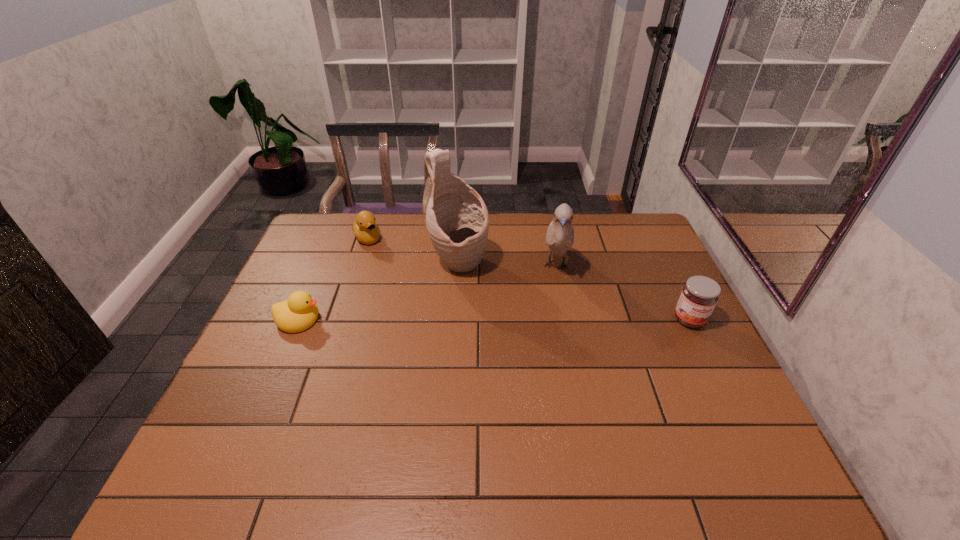
Image resolution: width=960 pixels, height=540 pixels. In order to click on vacant region between the shorter duckling and the pitcher in this screenshot , I will do `click(379, 292)`.

The width and height of the screenshot is (960, 540). I want to click on unoccupied position between the rightmost object and the second tallest object, so click(x=622, y=293).

Identify the location of free point between the fourth object from right to left and the third object from right to left. (413, 252).

The width and height of the screenshot is (960, 540). What are the coordinates of `empty space that is in between the jam and the shorter duckling` in the screenshot? It's located at (494, 319).

You are a GUI agent. You are given a task and a screenshot of the screen. Output one action in this format:
    pyautogui.click(x=<x>, y=<y>)
    Task: Click on the unoccupied area between the nearer duckling and the rightmost object
    This screenshot has width=960, height=540.
    Given the screenshot: What is the action you would take?
    pyautogui.click(x=494, y=319)

This screenshot has height=540, width=960. I want to click on vacant area between the tallest object and the jam, so click(x=574, y=292).

Find the location of a particular element. vacant region between the second object from left to right and the shortest object is located at coordinates (333, 279).

Where is `vacant area that lies between the pitcher and the leftmost object`? vacant area that lies between the pitcher and the leftmost object is located at coordinates (379, 292).

Identify the location of vacant area that lies between the jam and the nearer duckling. (494, 319).

The width and height of the screenshot is (960, 540). Identify the location of the fourth closest object to the second object from left to right. (699, 296).